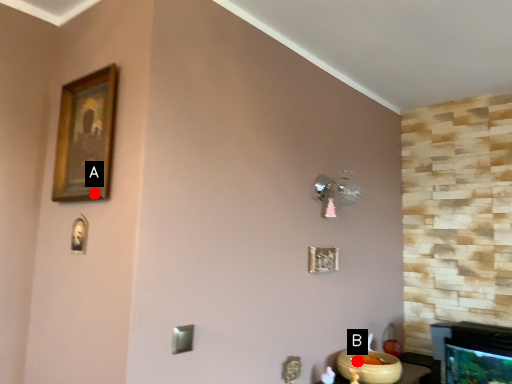
Question: Two points are circled on the image, labeled by A and B beside each circle. Which point is farther to the camera?

Choices:
 (A) A is further
 (B) B is further

Answer: (B)